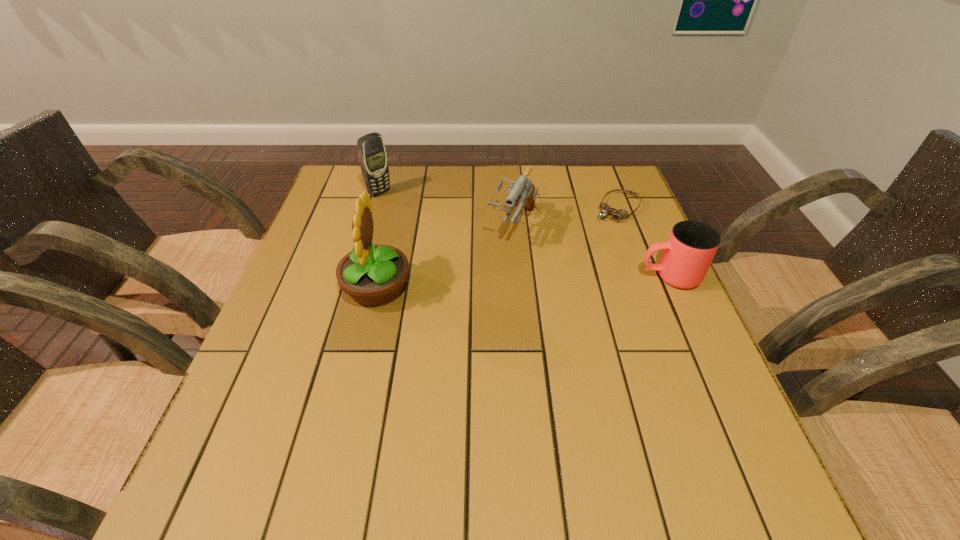
Locate an element on the screen. The height and width of the screenshot is (540, 960). free space at the far edge is located at coordinates (460, 187).

Where is `vacant region at the near edge of the desktop`? The height and width of the screenshot is (540, 960). vacant region at the near edge of the desktop is located at coordinates (641, 447).

Find the location of a particular element. vacant space at the left edge of the desktop is located at coordinates (264, 327).

Identify the location of free space at the right edge of the desktop. (673, 347).

Where is `vacant space at the far right corner of the desktop`? The image size is (960, 540). vacant space at the far right corner of the desktop is located at coordinates (612, 198).

Locate an element on the screen. The width and height of the screenshot is (960, 540). vacant region between the gun and the goggles is located at coordinates 566,217.

Locate an element on the screen. vacant space that is in between the gun and the sunflower is located at coordinates (446, 257).

Locate an element on the screen. The height and width of the screenshot is (540, 960). vacant area that lies between the third object from left to right and the cup is located at coordinates (592, 252).

The height and width of the screenshot is (540, 960). I want to click on vacant space that's between the cup and the sunflower, so click(523, 282).

I want to click on unoccupied position between the fourth tallest object and the third tallest object, so click(592, 252).